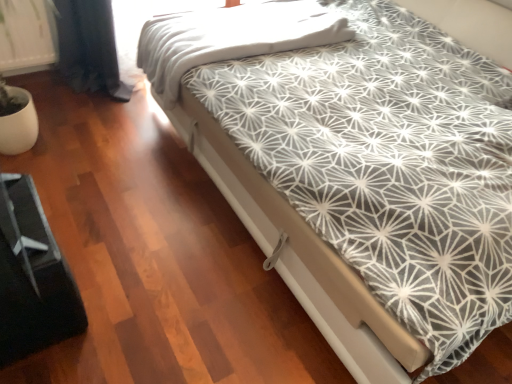
Question: Considering the positions of white textured blanket at upper center and white geometric-patterned bed at center in the image, is white textured blanket at upper center bigger or smaller than white geometric-patterned bed at center?

Choices:
 (A) small
 (B) big

Answer: (A)

Question: Is white textured blanket at upper center spatially inside white geometric-patterned bed at center, or outside of it?

Choices:
 (A) inside
 (B) outside

Answer: (A)

Question: Which object is positioned farthest from the white textured blanket at upper center?

Choices:
 (A) white geometric-patterned bed at center
 (B) black plastic bed frame at lower left

Answer: (B)

Question: Which is farther from the black plastic bed frame at lower left?

Choices:
 (A) white geometric-patterned bed at center
 (B) white textured blanket at upper center

Answer: (B)